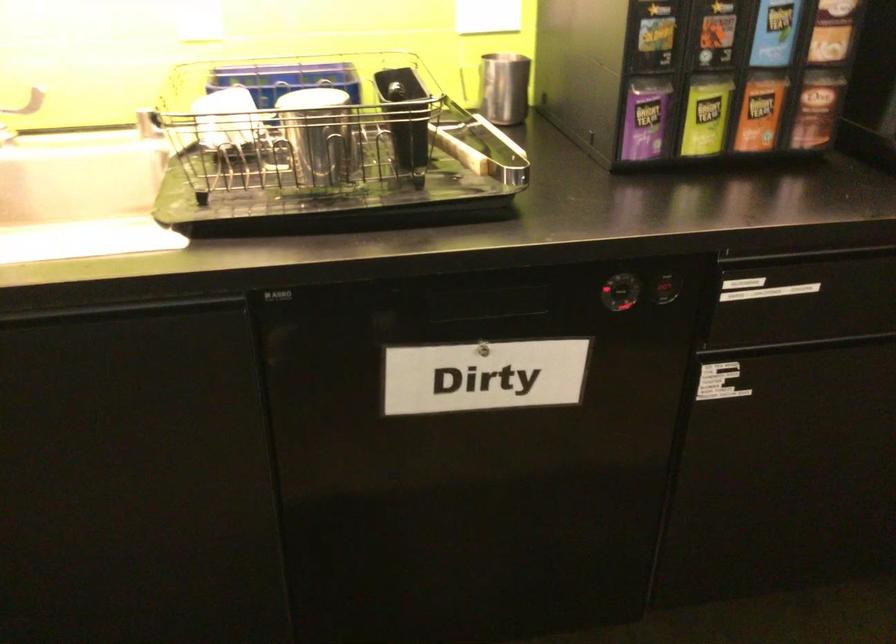
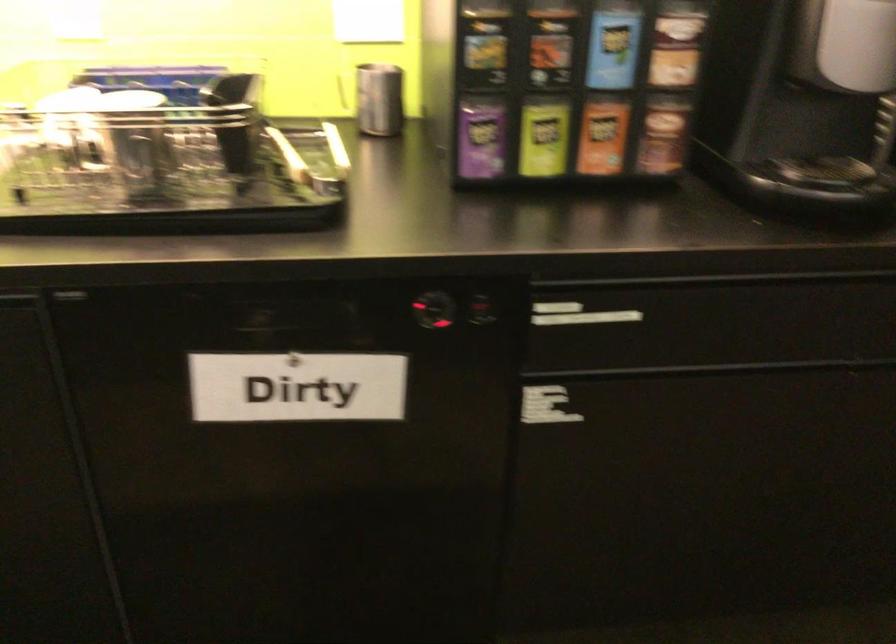
Locate, in the second image, the point that corresponds to point (763, 290) in the first image.

(578, 315)